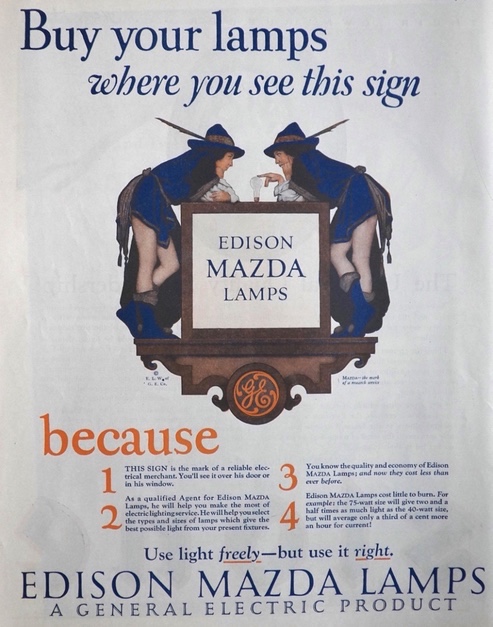
Identify the location of brown cart. (295, 364).